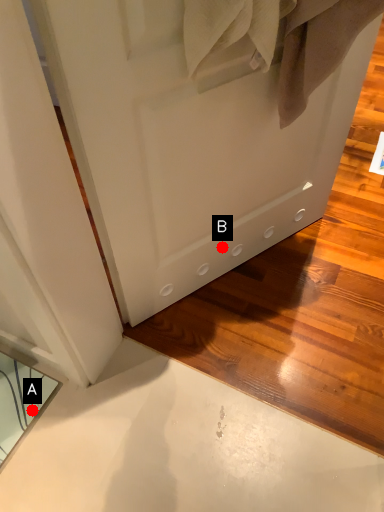
Question: Two points are circled on the image, labeled by A and B beside each circle. Which point is farther from the camera taking this photo?

Choices:
 (A) A is further
 (B) B is further

Answer: (B)